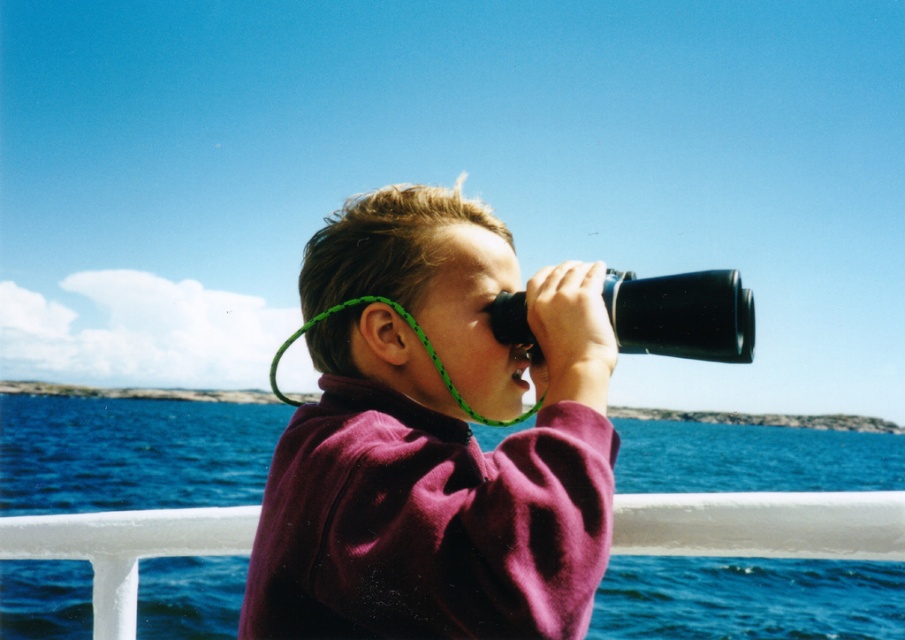
Question: Can you confirm if purple fleece jacket at center is wider than blue water at lower center?

Choices:
 (A) yes
 (B) no

Answer: (B)

Question: Which point is farther to the camera?

Choices:
 (A) (427, 212)
 (B) (724, 444)

Answer: (B)

Question: Can you confirm if purple fleece jacket at center is positioned below blue water at lower center?

Choices:
 (A) no
 (B) yes

Answer: (A)

Question: Is purple fleece jacket at center positioned behind blue water at lower center?

Choices:
 (A) yes
 (B) no

Answer: (B)